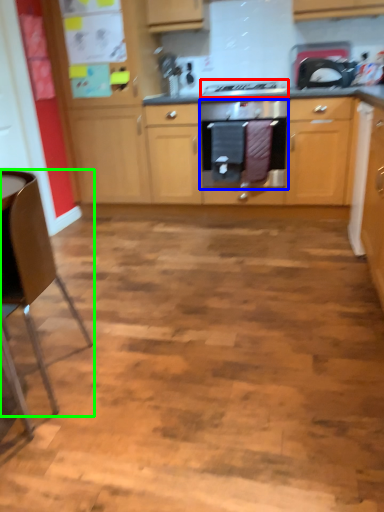
Question: Which is nearer to the gas stove (highlighted by a red box)? home appliance (highlighted by a blue box) or chair (highlighted by a green box).

Choices:
 (A) home appliance
 (B) chair

Answer: (A)